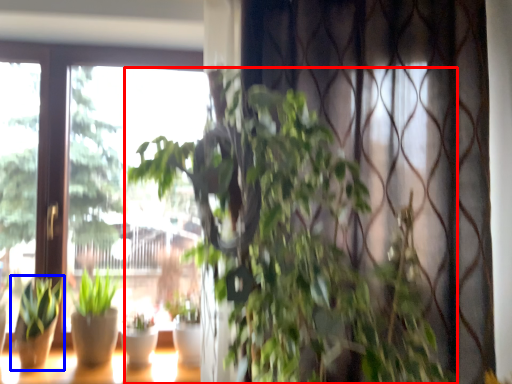
Question: Which object appears farthest to the camera in this image, houseplant (highlighted by a red box) or houseplant (highlighted by a blue box)?

Choices:
 (A) houseplant
 (B) houseplant

Answer: (B)